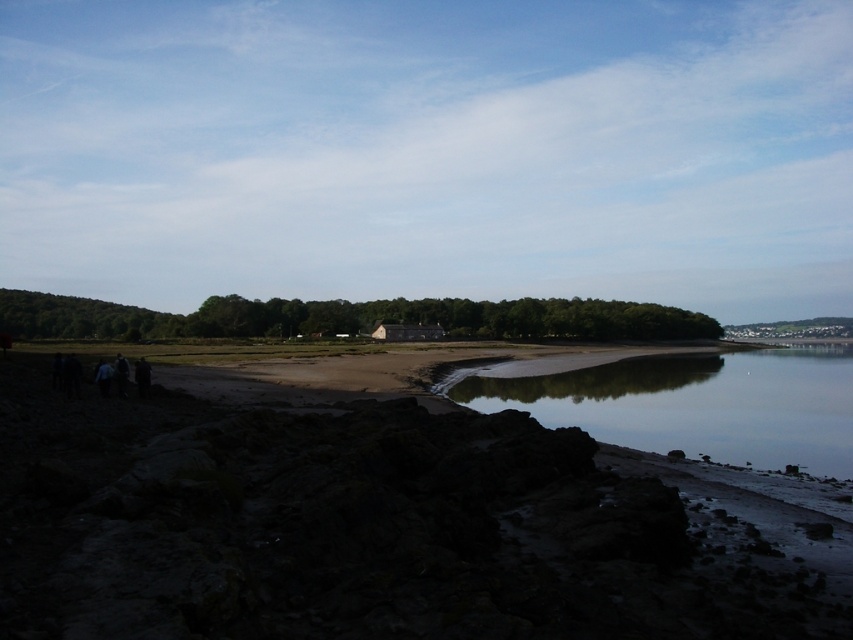
Question: Which point is closer to the camera?

Choices:
 (A) dark gray wooden hut at center
 (B) dark sand beach at center

Answer: (B)

Question: Does reflective smooth water at lower center appear under dark gray wooden hut at center?

Choices:
 (A) yes
 (B) no

Answer: (A)

Question: Which point is closer to the camera?

Choices:
 (A) dark sand beach at center
 (B) reflective smooth water at lower center
 (C) dark gray wooden hut at center

Answer: (A)

Question: Estimate the real-world distances between objects in this image. Which object is closer to the dark gray wooden hut at center?

Choices:
 (A) dark sand beach at center
 (B) reflective smooth water at lower center

Answer: (B)

Question: Does dark sand beach at center have a smaller size compared to dark gray wooden hut at center?

Choices:
 (A) yes
 (B) no

Answer: (A)

Question: Does dark sand beach at center appear under reflective smooth water at lower center?

Choices:
 (A) yes
 (B) no

Answer: (B)